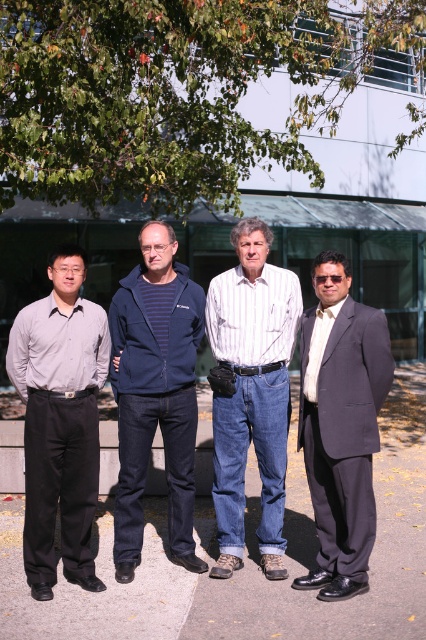
You are a photographer setting up for a group photo. You have a camera with a lens that can only capture a width of 1.5 meters. The two people you need to include are the striped cotton shirt at center and the dark blue suit at right. Can both fit within the camera frame if they stand side by side?

The striped cotton shirt at center might be wider than dark blue suit at right, so their combined width may exceed the 1.5 meter limit. It is uncertain if both can fit without overlapping.

You are standing in front of the modern building and want to locate the navy blue jacket at center. What are the coordinates where you can find it?

The navy blue jacket at center is located at coordinates point (155, 394).